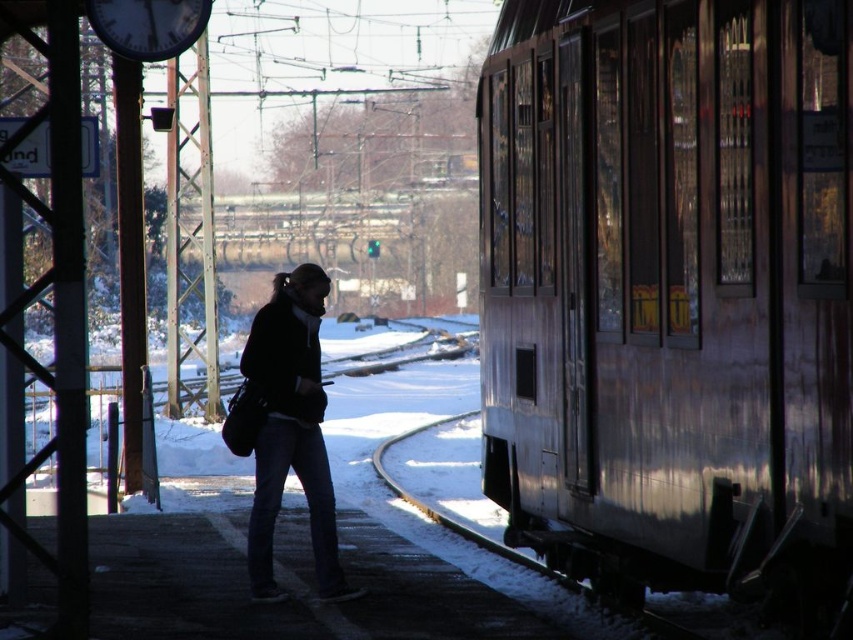
Question: Which of the following is the closest to the observer?

Choices:
 (A) dark blue jeans at center
 (B) wooden paneling train at right

Answer: (B)

Question: Does wooden paneling train at right appear on the right side of dark blue jeans at center?

Choices:
 (A) yes
 (B) no

Answer: (A)

Question: Does wooden paneling train at right appear over dark blue jeans at center?

Choices:
 (A) yes
 (B) no

Answer: (A)

Question: Is wooden paneling train at right closer to the viewer compared to dark blue jeans at center?

Choices:
 (A) yes
 (B) no

Answer: (A)

Question: Which of the following is the closest to the observer?

Choices:
 (A) wooden paneling train at right
 (B) dark blue jeans at center

Answer: (A)